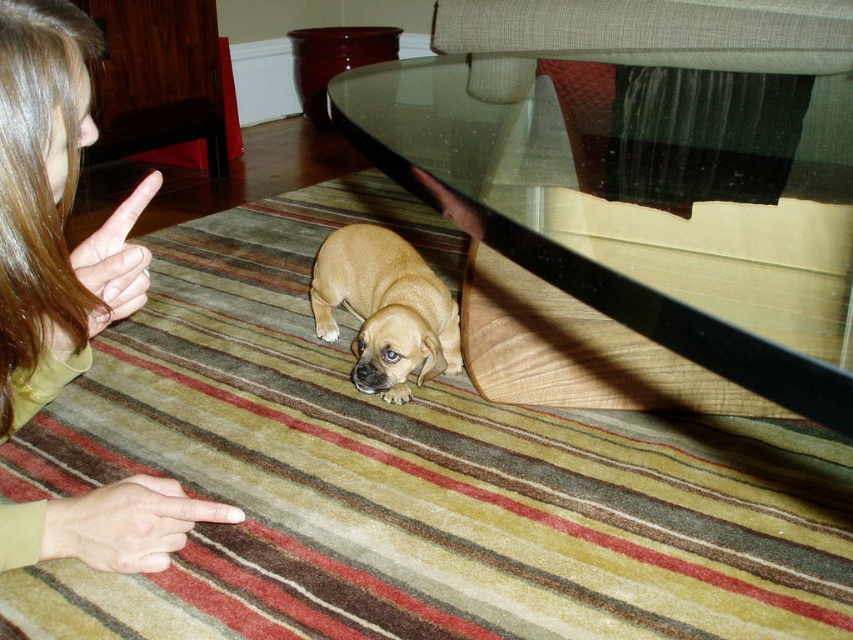
Can you confirm if light brown fur at center is shorter than matte brown hand at lower center?

Incorrect, light brown fur at center's height does not fall short of matte brown hand at lower center's.

Does light brown fur at center appear under matte brown hand at lower center?

Correct, light brown fur at center is located below matte brown hand at lower center.

Is point (378, 316) farther from camera compared to point (437, 196)?

Yes, point (378, 316) is farther from viewer.

This screenshot has height=640, width=853. Identify the location of light brown fur at center. (386, 308).

What do you see at coordinates (650, 202) in the screenshot? I see `transparent glass table at lower center` at bounding box center [650, 202].

Can you confirm if transparent glass table at lower center is smaller than light brown fur at center?

Actually, transparent glass table at lower center might be larger than light brown fur at center.

Is point (589, 232) positioned behind point (360, 276)?

No, it is in front of (360, 276).

Identify the location of transparent glass table at lower center. (650, 202).

Between smooth green shirt at lower left and matte brown hand at lower center, which one is positioned higher?

matte brown hand at lower center is higher up.

Measure the distance from smooth green shirt at lower left to matte brown hand at lower center.

They are 14.70 inches apart.

Between point (64, 326) and point (468, 225), which one is positioned in front?

Positioned in front is point (64, 326).

Identify the location of smooth green shirt at lower left. The height and width of the screenshot is (640, 853). (53, 211).